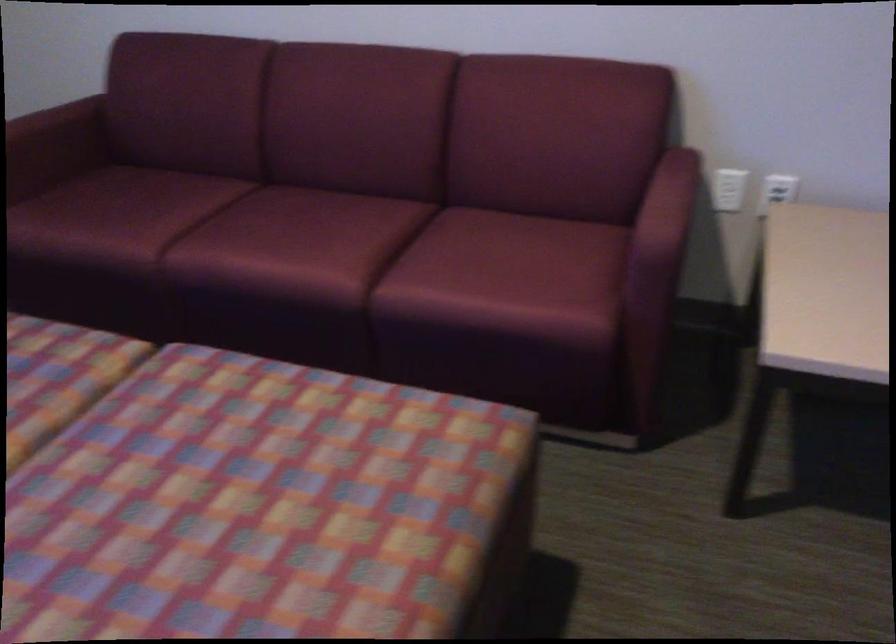
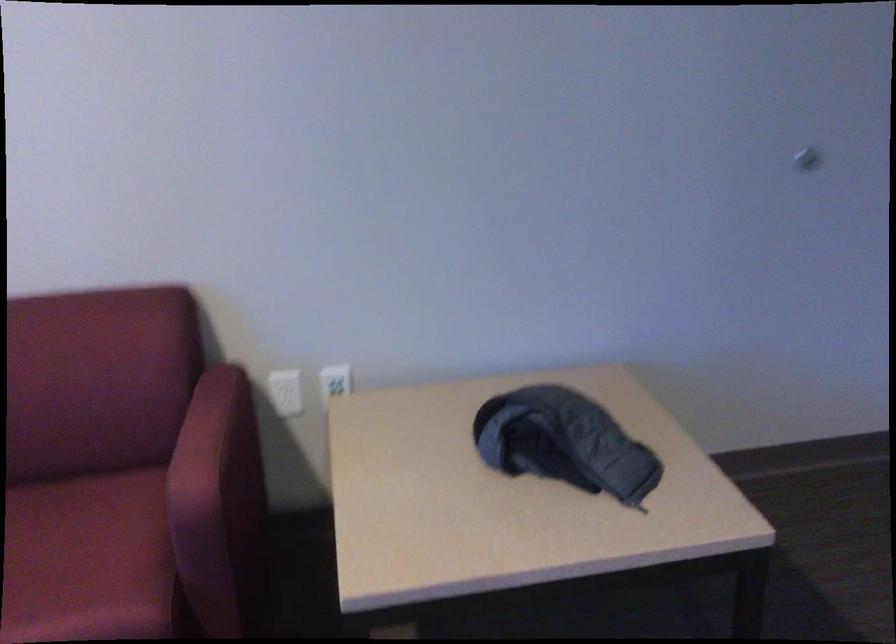
The point at [553,272] is marked in the first image. Where is the corresponding point in the second image?

(88, 560)